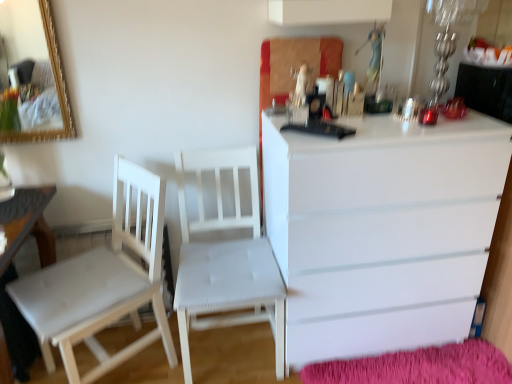
Locate an element on the screen. vacant space situated above white glossy chest of drawers at right (from a real-world perspective) is located at coordinates (366, 115).